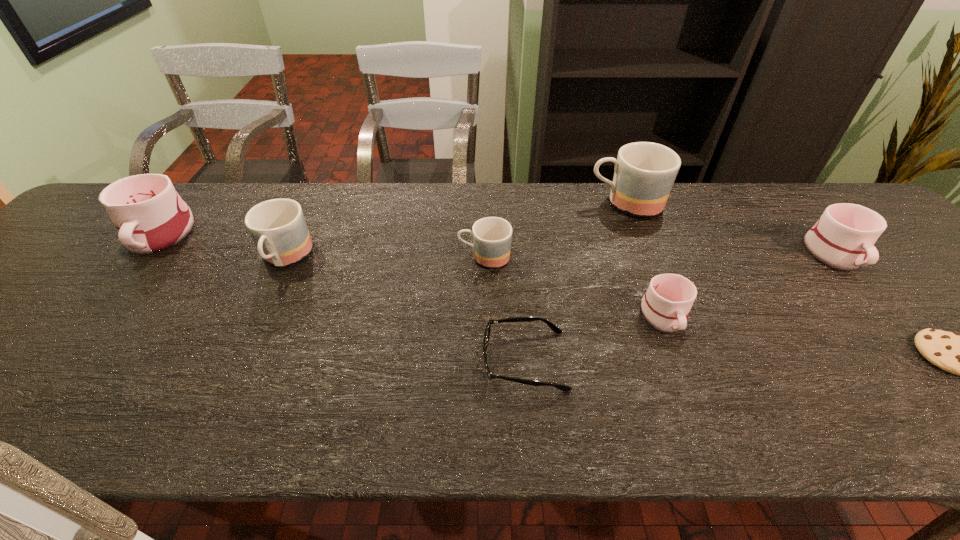
In the image, there is a desktop. Identify the location of vacant region at the far edge. (316, 195).

You are a GUI agent. You are given a task and a screenshot of the screen. Output one action in this format:
    pyautogui.click(x=<x>, y=<y>)
    Task: Click on the vacant space at the near edge of the desktop
    The width and height of the screenshot is (960, 540).
    Given the screenshot: What is the action you would take?
    pyautogui.click(x=271, y=428)

In the image, there is a desktop. In order to click on vacant space at the left edge in this screenshot , I will do `click(63, 294)`.

This screenshot has height=540, width=960. Find the location of `free space between the rightmost blue mug and the spectacles`. free space between the rightmost blue mug and the spectacles is located at coordinates (575, 281).

Find the location of a particular element. The width and height of the screenshot is (960, 540). vacant space that is in between the second white mug from right to left and the rightmost white mug is located at coordinates (750, 285).

In order to click on blank region between the spectacles and the leftmost mug in this screenshot , I will do `click(342, 298)`.

Where is `free space between the third mug from left to right and the second biggest white mug`? Image resolution: width=960 pixels, height=540 pixels. free space between the third mug from left to right and the second biggest white mug is located at coordinates (660, 255).

You are a GUI agent. You are given a task and a screenshot of the screen. Output one action in this format:
    pyautogui.click(x=<x>, y=<y>)
    Task: Click on the free space between the nearest mug and the second biggest white mug
    
    Given the screenshot: What is the action you would take?
    pyautogui.click(x=750, y=285)

Locate an element on the screen. The image size is (960, 540). blank region between the spectacles and the fifth mug from right to left is located at coordinates (405, 309).

The height and width of the screenshot is (540, 960). In order to click on object that is the fourth closest to the spectacles in this screenshot , I will do `click(278, 228)`.